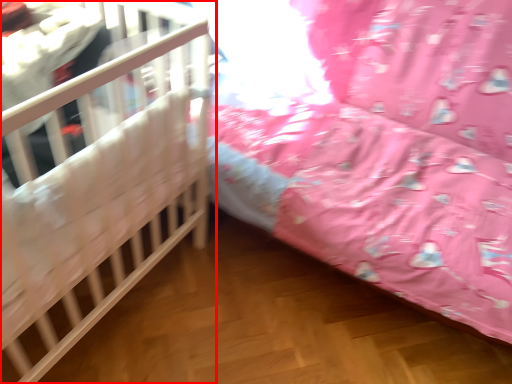
Question: From the image, what is the correct spatial relationship of infant bed (annotated by the red box) in relation to infant bed?

Choices:
 (A) left
 (B) right

Answer: (A)